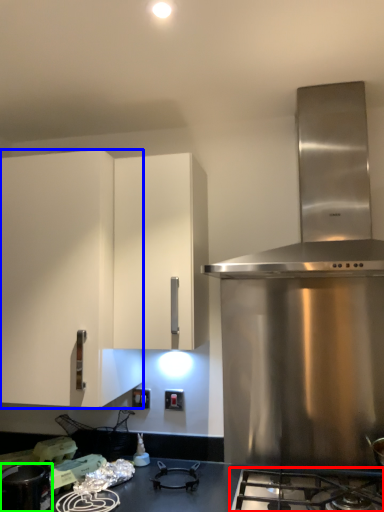
Question: Which object is the farthest from gas stove (highlighted by a red box)? Choose among these: cabinetry (highlighted by a blue box) or kitchen appliance (highlighted by a green box).

Choices:
 (A) cabinetry
 (B) kitchen appliance

Answer: (A)